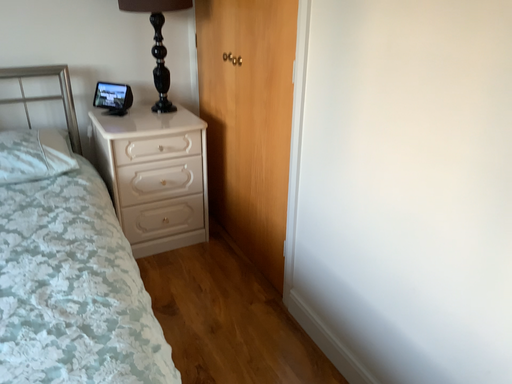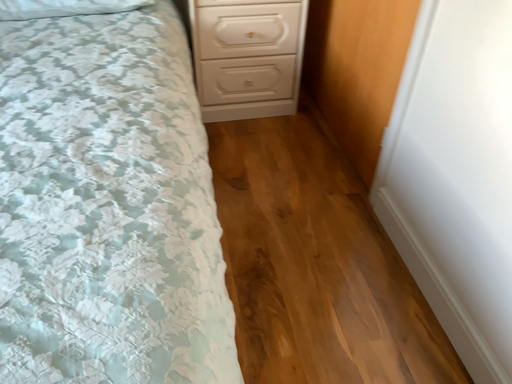
Question: How did the camera likely rotate when shooting the video?

Choices:
 (A) rotated downward
 (B) rotated upward

Answer: (A)